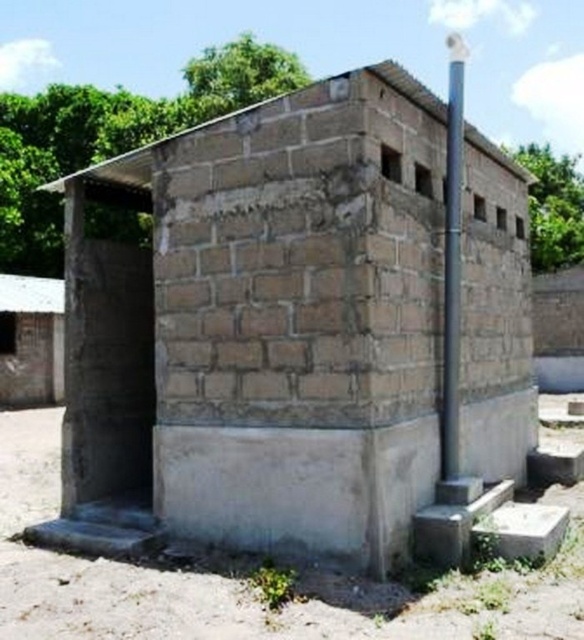
You are standing in front of a small rectangular structure with a sloped roof. You see a brick wall hut at center marked by point (311, 328). Can you determine the location of the entrance relative to this point?

The entrance is on one side of the brick wall hut at center marked by point (311, 328), but the exact direction isn cannot be determined from the given information.

You are a delivery person trying to park your 2.5 meter wide delivery van. You see the brick wall hut at center and the blue metallic pole at upper right. Which object has enough space for the van to park without hitting anything?

The blue metallic pole at upper right has enough space for the van to park without hitting anything because the brick wall hut at center is narrower than the blue metallic pole at upper right.

You are a painter who needs to paint both the brick wall hut at center and the blue metallic pole at upper right. Based on their sizes, which object will require more paint?

The blue metallic pole at upper right will require more paint because it is larger than the brick wall hut at center according to the description.